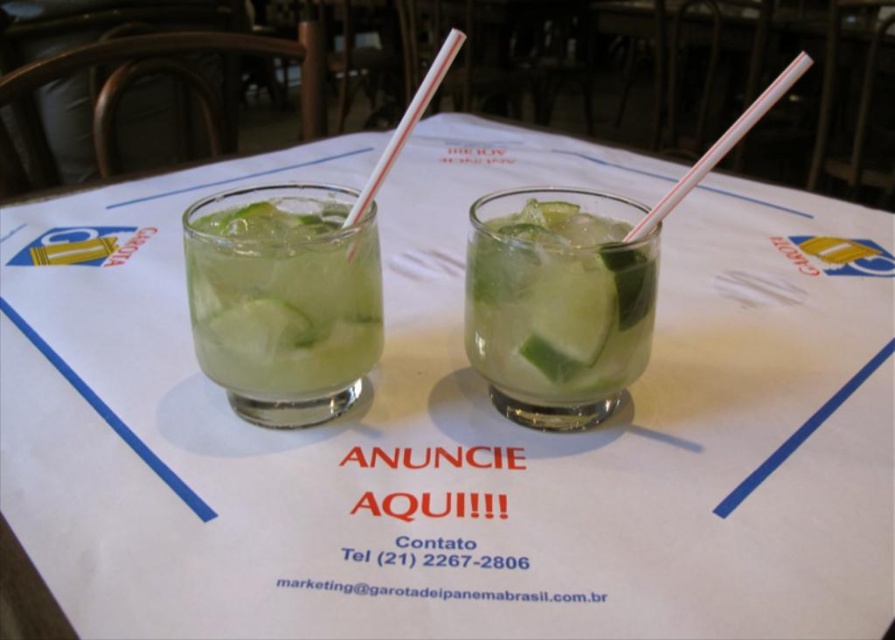
Can you confirm if green translucent glass at center is positioned to the right of white striped plastic straw at center?

Yes, green translucent glass at center is to the right of white striped plastic straw at center.

Locate an element on the screen. green translucent glass at center is located at coordinates (557, 301).

Does green translucent glass at center appear over translucent glass drink at left?

Incorrect, green translucent glass at center is not positioned above translucent glass drink at left.

Is the position of green translucent glass at center more distant than that of translucent glass drink at left?

Yes, green translucent glass at center is further from the viewer.

Where is `green translucent glass at center`? Image resolution: width=895 pixels, height=640 pixels. green translucent glass at center is located at coordinates (557, 301).

Locate an element on the screen. green translucent glass at center is located at coordinates (557, 301).

Is point (345, 257) positioned after point (354, 204)?

No, it is in front of (354, 204).

Is translucent glass drink at left to the left of white striped plastic straw at center from the viewer's perspective?

Correct, you'll find translucent glass drink at left to the left of white striped plastic straw at center.

The width and height of the screenshot is (895, 640). What do you see at coordinates (282, 296) in the screenshot? I see `translucent glass drink at left` at bounding box center [282, 296].

This screenshot has width=895, height=640. I want to click on translucent glass drink at left, so click(x=282, y=296).